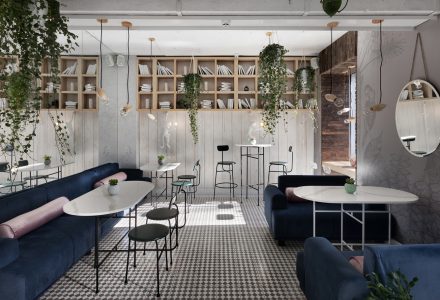
Locate an element on the screen. Image resolution: width=440 pixels, height=300 pixels. cushion is located at coordinates (356, 263), (289, 193), (34, 213), (120, 175).